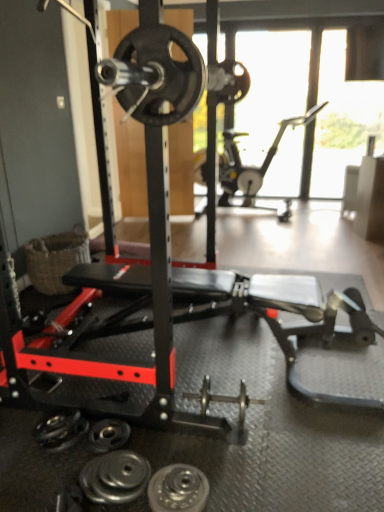
This screenshot has width=384, height=512. What are the coordinates of `vacant area that lies in front of polished silver dumbbell at center, the first dumbbell from the back` in the screenshot? It's located at (235, 456).